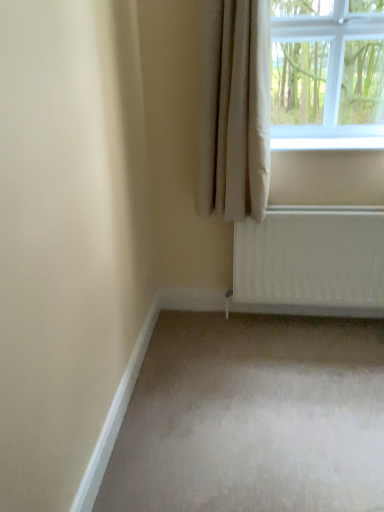
You are a GUI agent. You are given a task and a screenshot of the screen. Output one action in this format:
    pyautogui.click(x=<x>, y=<y>)
    Task: Click on the vacant space underneath white glass window at upper right (from a real-world perspective)
    The image size is (384, 512).
    Given the screenshot: What is the action you would take?
    pyautogui.click(x=331, y=139)